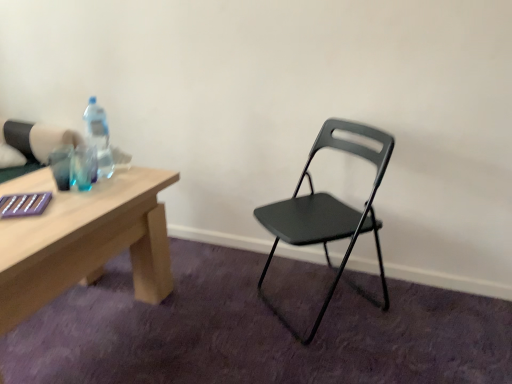
Question: Considering their positions, is matte black folding chair at center located in front of or behind translucent plastic bottle at table left?

Choices:
 (A) behind
 (B) front

Answer: (B)

Question: In terms of width, does matte black folding chair at center look wider or thinner when compared to translucent plastic bottle at table left?

Choices:
 (A) thin
 (B) wide

Answer: (B)

Question: Considering the positions of matte black folding chair at center and translucent plastic bottle at table left in the image, is matte black folding chair at center bigger or smaller than translucent plastic bottle at table left?

Choices:
 (A) small
 (B) big

Answer: (B)

Question: In terms of size, does translucent plastic bottle at table left appear bigger or smaller than matte black folding chair at center?

Choices:
 (A) small
 (B) big

Answer: (A)

Question: Is translucent plastic bottle at table left spatially inside matte black folding chair at center, or outside of it?

Choices:
 (A) inside
 (B) outside

Answer: (B)

Question: Would you say translucent plastic bottle at table left is to the left or to the right of matte black folding chair at center in the picture?

Choices:
 (A) left
 (B) right

Answer: (A)

Question: Considering the positions of translucent plastic bottle at table left and matte black folding chair at center in the image, is translucent plastic bottle at table left wider or thinner than matte black folding chair at center?

Choices:
 (A) wide
 (B) thin

Answer: (B)